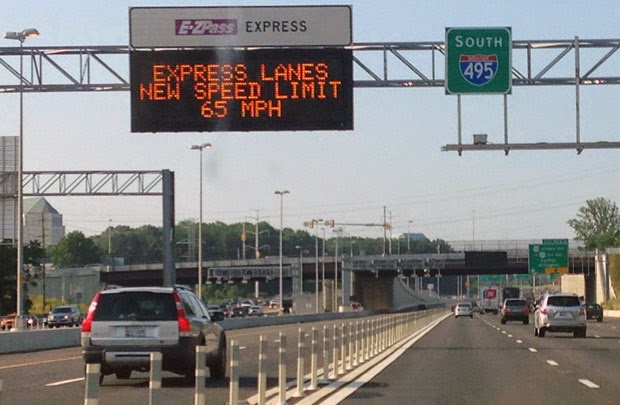
This screenshot has height=405, width=620. I want to click on door, so click(x=198, y=308).